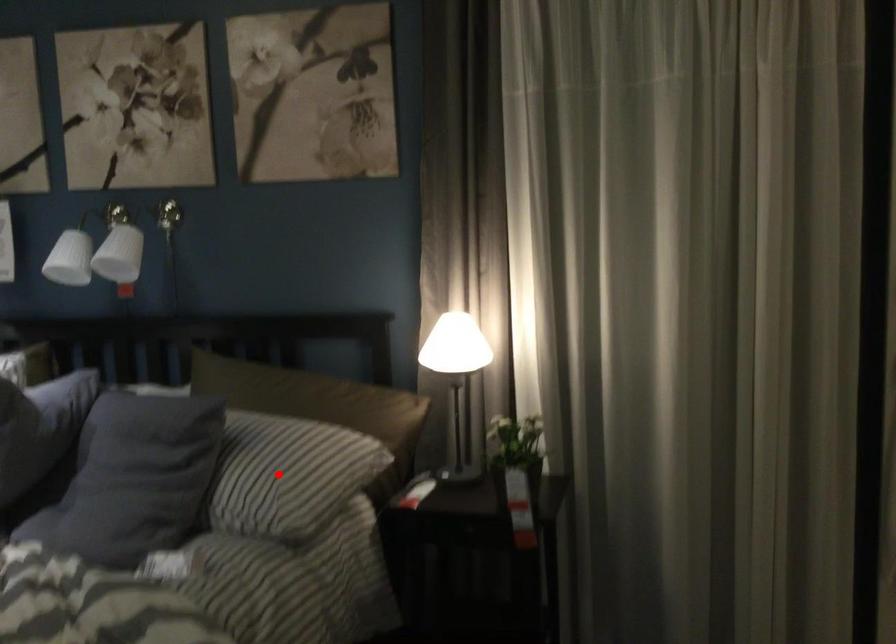
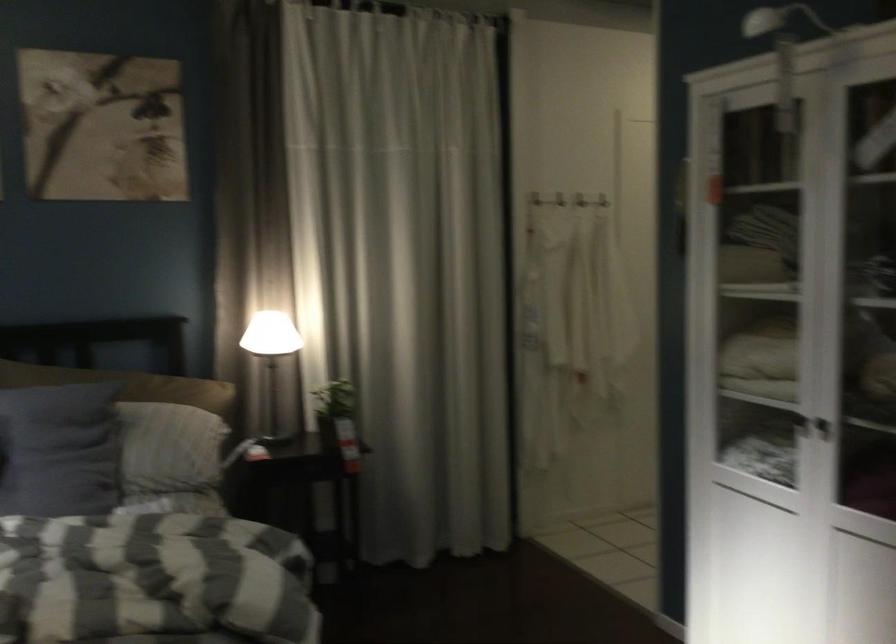
The point at the highlighted location is marked in the first image. Where is the corresponding point in the second image?

(173, 442)